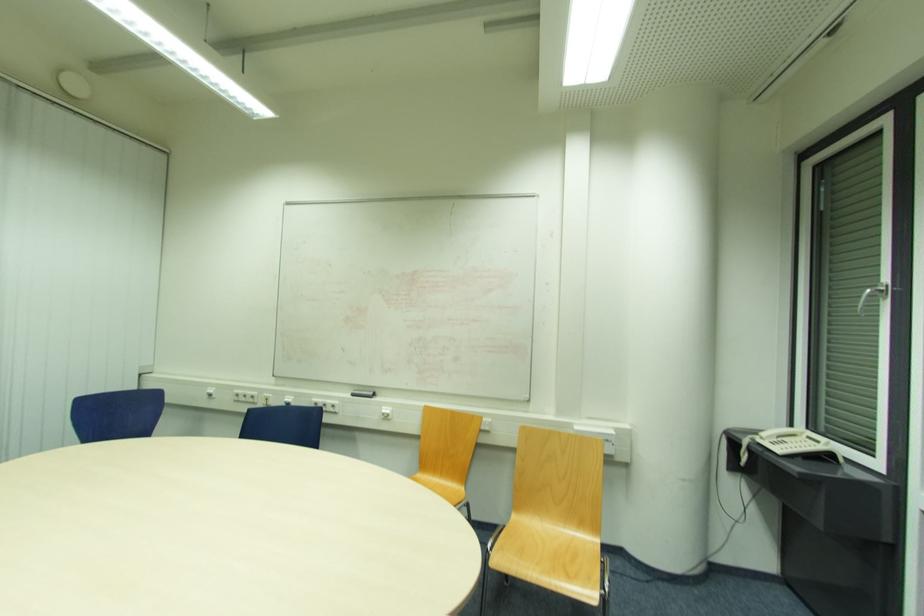
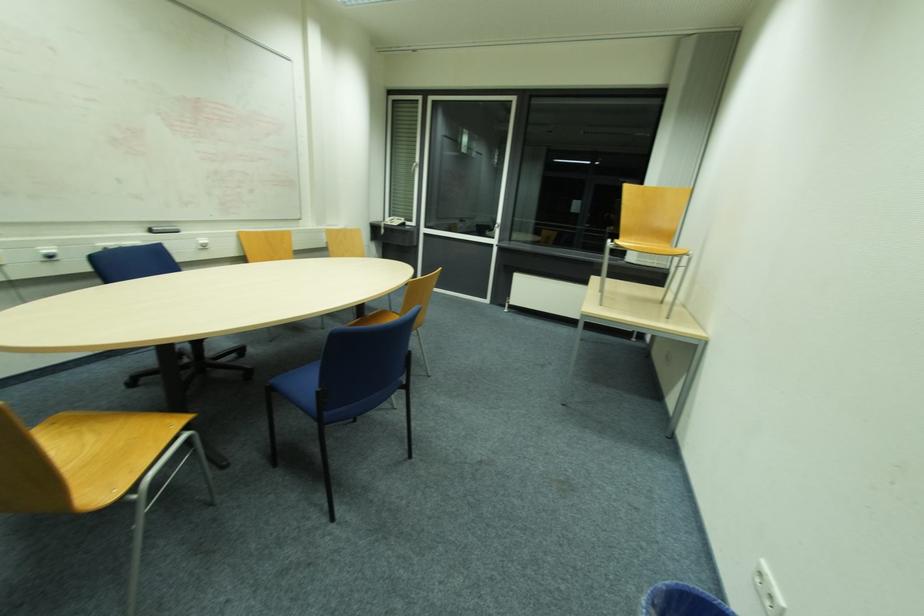
In the second image, find the point that corresponds to point (779, 450) in the first image.

(397, 225)